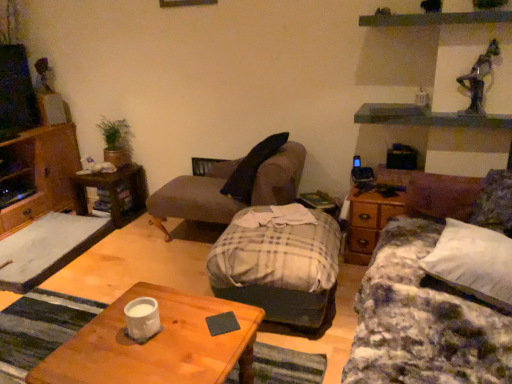
Locate an element on the screen. Image resolution: width=512 pixels, height=384 pixels. blank space above wooden side table at right (from a real-world perspective) is located at coordinates (385, 188).